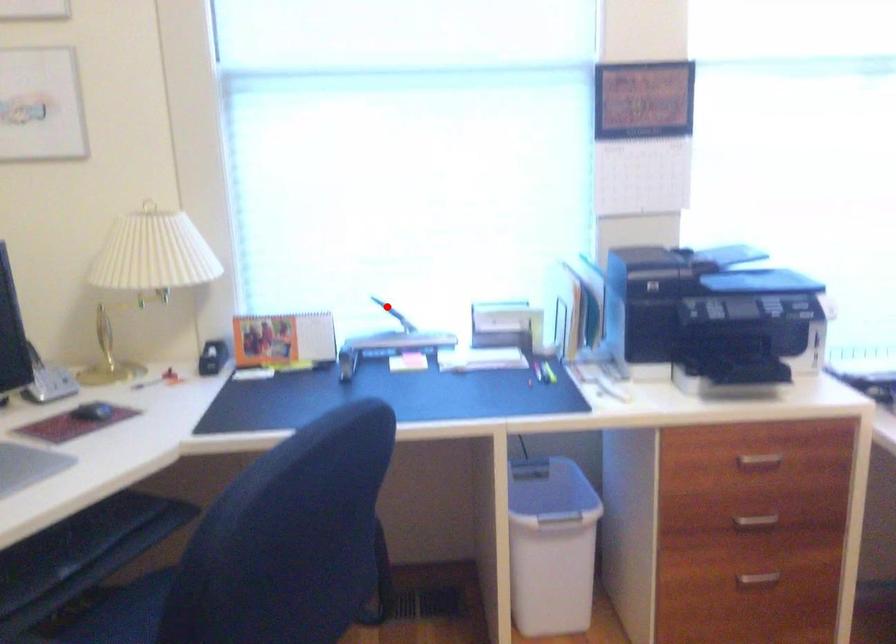
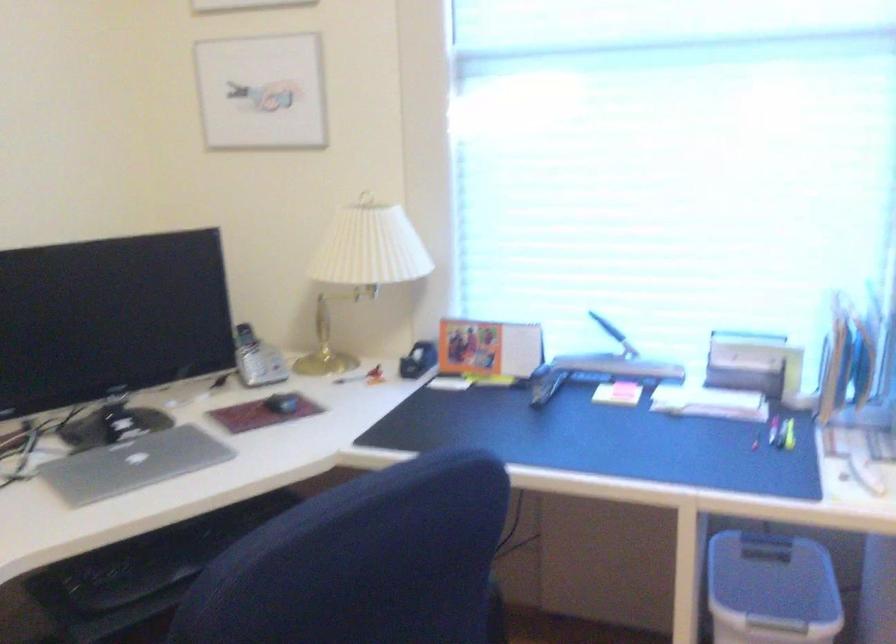
Question: I am providing you with two images of the same scene from different viewpoints. Image1 has a red point marked. In image2, the corresponding 3D location appears at what relative position? Reply with the corresponding letter.

Choices:
 (A) Closer
 (B) Farther

Answer: (A)